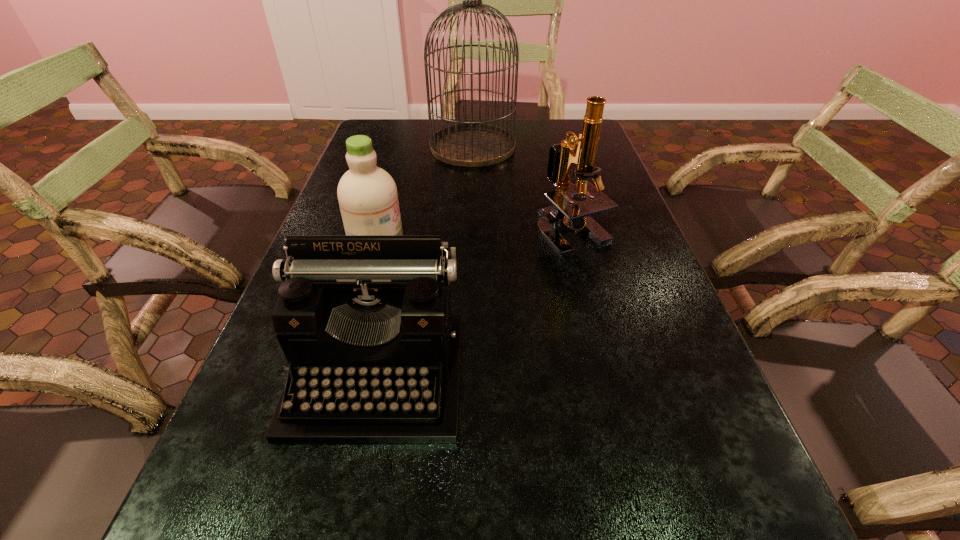
You are a GUI agent. You are given a task and a screenshot of the screen. Output one action in this format:
    pyautogui.click(x=<x>, y=<y>)
    Task: Click on the tallest object
    
    Given the screenshot: What is the action you would take?
    pyautogui.click(x=471, y=144)

This screenshot has width=960, height=540. In order to click on birdcage in this screenshot , I will do `click(471, 144)`.

Locate an element on the screen. the second tallest object is located at coordinates (565, 211).

Identify the location of microscope. (565, 211).

Where is `cleansing agent`? cleansing agent is located at coordinates (368, 199).

At what (x,y) coordinates should I click in order to perform the action: click on typewriter. Please return your answer as a coordinate pair (x, y). This screenshot has width=960, height=540. Looking at the image, I should click on (365, 322).

At what (x,y) coordinates should I click in order to perform the action: click on free spot located on the right of the tallest object. Please return your answer as a coordinate pair (x, y). The width and height of the screenshot is (960, 540). Looking at the image, I should click on (595, 147).

Find the location of a particular element. The width and height of the screenshot is (960, 540). free spot located 0.210m at the eyepiece of the second tallest object is located at coordinates (597, 329).

Image resolution: width=960 pixels, height=540 pixels. Find the location of `free space located 0.220m on the front label of the cleansing agent`. free space located 0.220m on the front label of the cleansing agent is located at coordinates (493, 238).

In order to click on free region located 0.120m on the typing side of the typewriter in this screenshot , I will do `click(346, 528)`.